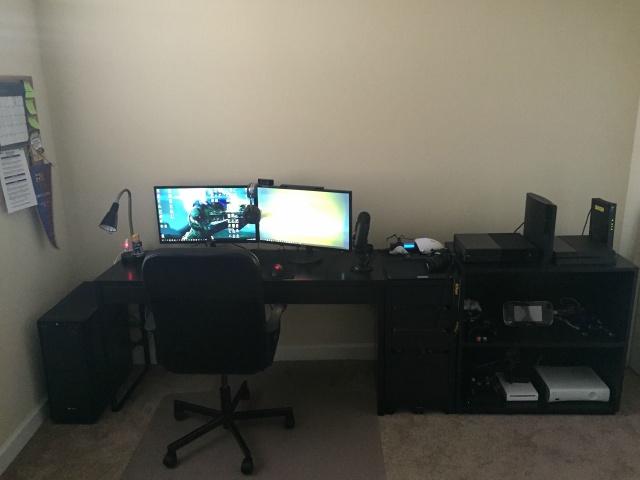
Image resolution: width=640 pixels, height=480 pixels. I want to click on right chair arm, so click(x=271, y=284).